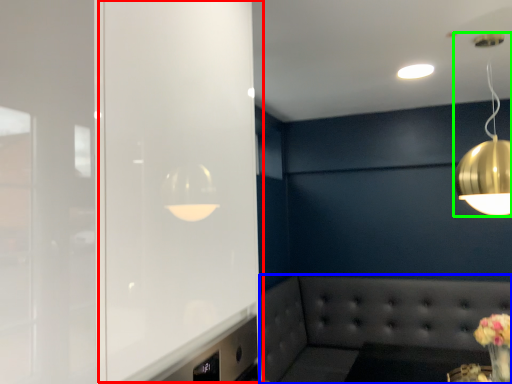
Question: Which is nearer to the glass door (highlighted by a red box)? couch (highlighted by a blue box) or lamp (highlighted by a green box).

Choices:
 (A) couch
 (B) lamp

Answer: (B)